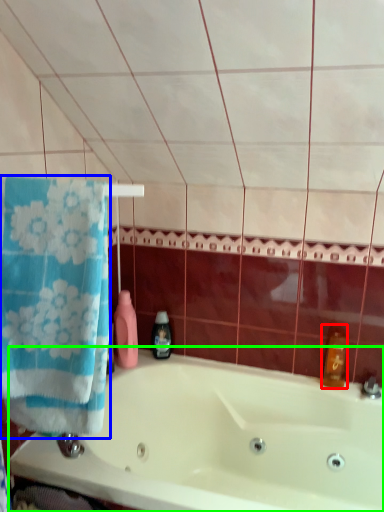
Question: Which object is positioned farthest from cleaning product (highlighted by a red box)? Select from towel (highlighted by a blue box) and bathtub (highlighted by a green box).

Choices:
 (A) towel
 (B) bathtub

Answer: (A)